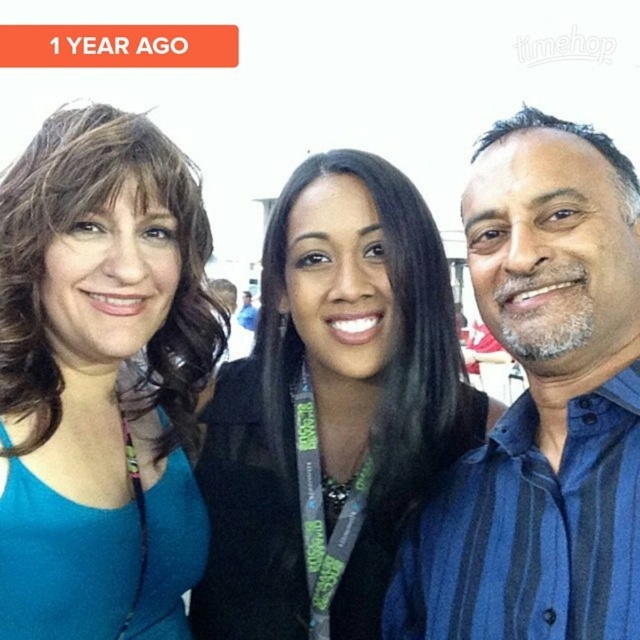
Is black fabric jacket at center bigger than blue striped shirt at center?

Yes, black fabric jacket at center is bigger than blue striped shirt at center.

Looking at this image, who is shorter, black fabric jacket at center or blue striped shirt at center?

Standing shorter between the two is blue striped shirt at center.

You are a GUI agent. You are given a task and a screenshot of the screen. Output one action in this format:
    pyautogui.click(x=<x>, y=<y>)
    Task: Click on the black fabric jacket at center
    
    Given the screenshot: What is the action you would take?
    pyautogui.click(x=332, y=408)

At what (x,y) coordinates should I click in order to perform the action: click on black fabric jacket at center. Please return your answer as a coordinate pair (x, y). Image resolution: width=640 pixels, height=640 pixels. Looking at the image, I should click on (332, 408).

In the scene shown: Can you confirm if blue striped shirt at center is smaller than matte teal tank top at left?

Actually, blue striped shirt at center might be larger than matte teal tank top at left.

Is blue striped shirt at center taller than matte teal tank top at left?

No.

Between point (589, 272) and point (81, 577), which one is positioned in front?

Point (81, 577)

Find the location of `blue striped shirt at center`. blue striped shirt at center is located at coordinates (541, 404).

Is point (307, 307) closer to viewer compared to point (182, 308)?

Yes, it is.

From the picture: Is black fabric jacket at center smaller than matte teal tank top at left?

Actually, black fabric jacket at center might be larger than matte teal tank top at left.

Is point (394, 257) more distant than point (150, 410)?

That is False.

Find the location of a particular element. The image size is (640, 640). black fabric jacket at center is located at coordinates (332, 408).